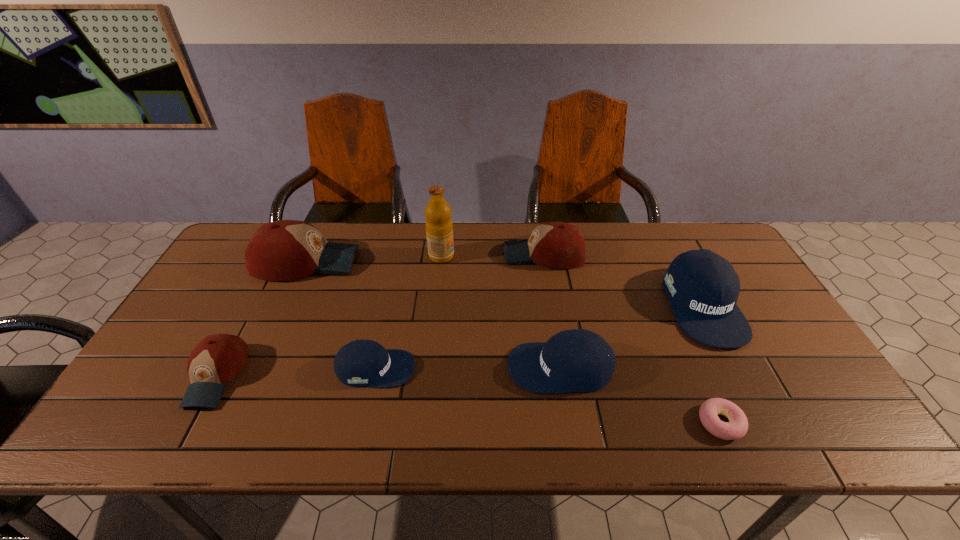
Image resolution: width=960 pixels, height=540 pixels. What are the coordinates of `blank area in the image that satisfies the following two spatial constraints: 1. on the front-facing side of the rightmost baseball cap; 2. on the front-facing side of the third baseball cap from left to right` in the screenshot? It's located at (735, 369).

At what (x,y) coordinates should I click in order to perform the action: click on vacant point that satisfies the following two spatial constraints: 1. on the front-facing side of the pink doughnut; 2. on the left side of the smallest blue baseball cap. Please return your answer as a coordinate pair (x, y). Looking at the image, I should click on (364, 423).

You are a GUI agent. You are given a task and a screenshot of the screen. Output one action in this format:
    pyautogui.click(x=<x>, y=<y>)
    Task: Click on the free spot that satisfies the following two spatial constraints: 1. on the front-facing side of the rightmost red baseball cap; 2. on the right side of the shortest object
    
    Given the screenshot: What is the action you would take?
    pyautogui.click(x=572, y=423)

I want to click on vacant space that satisfies the following two spatial constraints: 1. on the front label of the pink doughnut; 2. on the right side of the fruit juice, so click(424, 423).